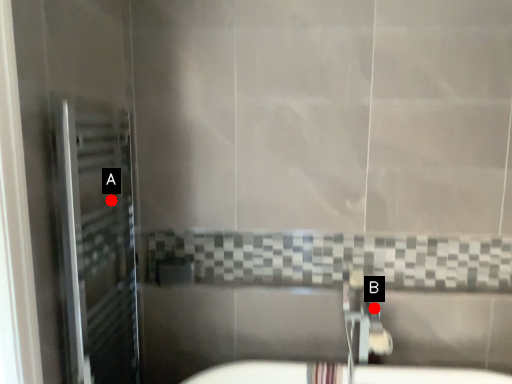
Question: Two points are circled on the image, labeled by A and B beside each circle. Which point appears farthest from the camera in this image?

Choices:
 (A) A is further
 (B) B is further

Answer: (B)